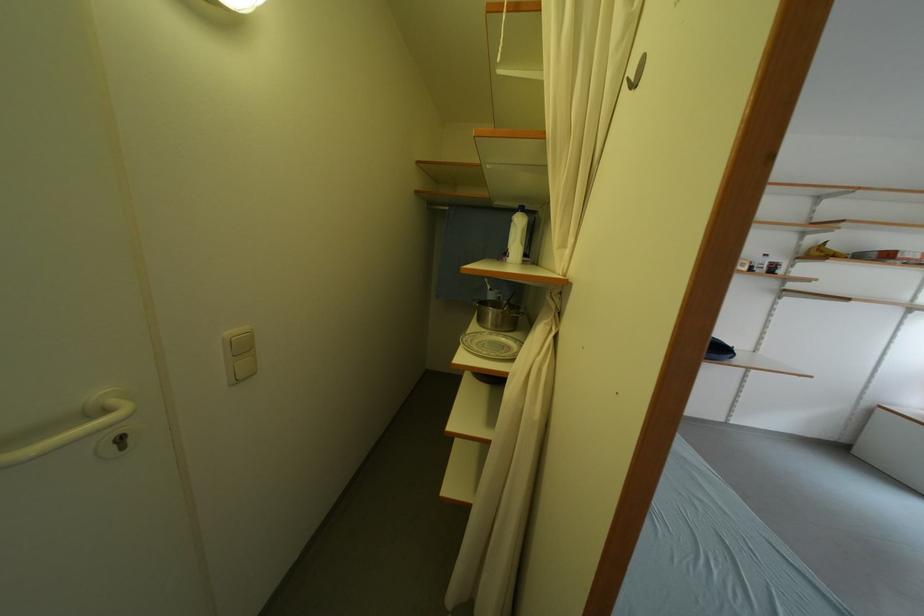
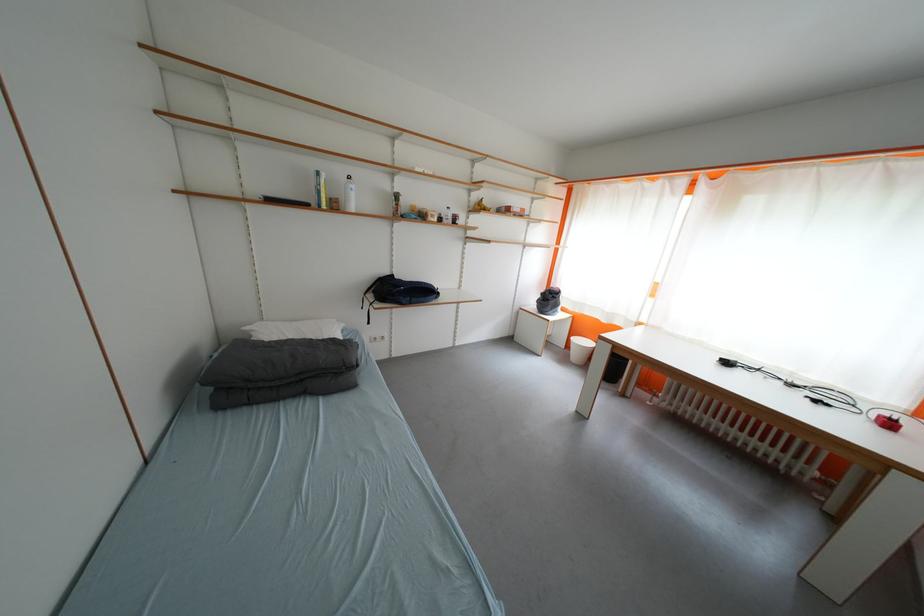
Question: The images are taken continuously from a first-person perspective. In which direction is your viewpoint rotating?

Choices:
 (A) Left
 (B) Right
 (C) Up
 (D) Down

Answer: (B)